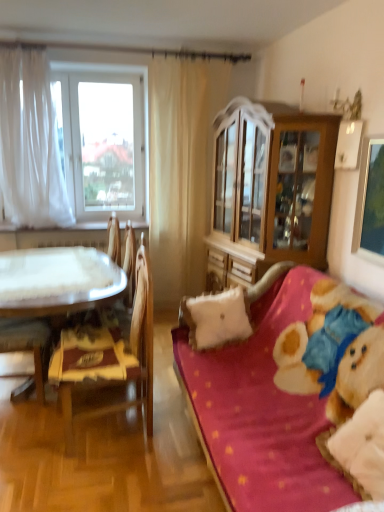
Question: Can you see white sheer curtain at left touching velvet-like beige armchair at left?

Choices:
 (A) no
 (B) yes

Answer: (A)

Question: From the image's perspective, does white sheer curtain at left appear lower than velvet-like beige armchair at left?

Choices:
 (A) no
 (B) yes

Answer: (A)

Question: Would you say velvet-like beige armchair at left is part of white sheer curtain at left's contents?

Choices:
 (A) yes
 (B) no

Answer: (B)

Question: Is white sheer curtain at left completely or partially outside of velvet-like beige armchair at left?

Choices:
 (A) yes
 (B) no

Answer: (A)

Question: From a real-world perspective, is white sheer curtain at left positioned over velvet-like beige armchair at left based on gravity?

Choices:
 (A) yes
 (B) no

Answer: (A)

Question: Considering the positions of point (56, 274) and point (89, 352), is point (56, 274) closer or farther from the camera than point (89, 352)?

Choices:
 (A) closer
 (B) farther

Answer: (B)

Question: Considering their positions, is white glossy table at left located in front of or behind wooden chair at left?

Choices:
 (A) front
 (B) behind

Answer: (B)

Question: From the image's perspective, is white glossy table at left positioned above or below wooden chair at left?

Choices:
 (A) below
 (B) above

Answer: (B)

Question: Considering the positions of white glossy table at left and wooden chair at left in the image, is white glossy table at left wider or thinner than wooden chair at left?

Choices:
 (A) wide
 (B) thin

Answer: (A)

Question: Considering the positions of point (114, 246) and point (357, 241), is point (114, 246) closer or farther from the camera than point (357, 241)?

Choices:
 (A) closer
 (B) farther

Answer: (B)

Question: From a real-world perspective, relative to metallic silver picture frame at upper right, is velvet-like beige armchair at left vertically above or below?

Choices:
 (A) below
 (B) above

Answer: (A)

Question: Is velvet-like beige armchair at left in front of or behind metallic silver picture frame at upper right in the image?

Choices:
 (A) behind
 (B) front

Answer: (A)

Question: Based on their sizes in the image, would you say velvet-like beige armchair at left is bigger or smaller than metallic silver picture frame at upper right?

Choices:
 (A) big
 (B) small

Answer: (A)

Question: Is white sheer curtain at left, positioned as the first curtain in left-to-right order, taller or shorter than metallic silver picture frame at upper right?

Choices:
 (A) short
 (B) tall

Answer: (B)

Question: In the image, is white sheer curtain at left, the 2th curtain positioned from the right, positioned in front of or behind metallic silver picture frame at upper right?

Choices:
 (A) behind
 (B) front

Answer: (A)